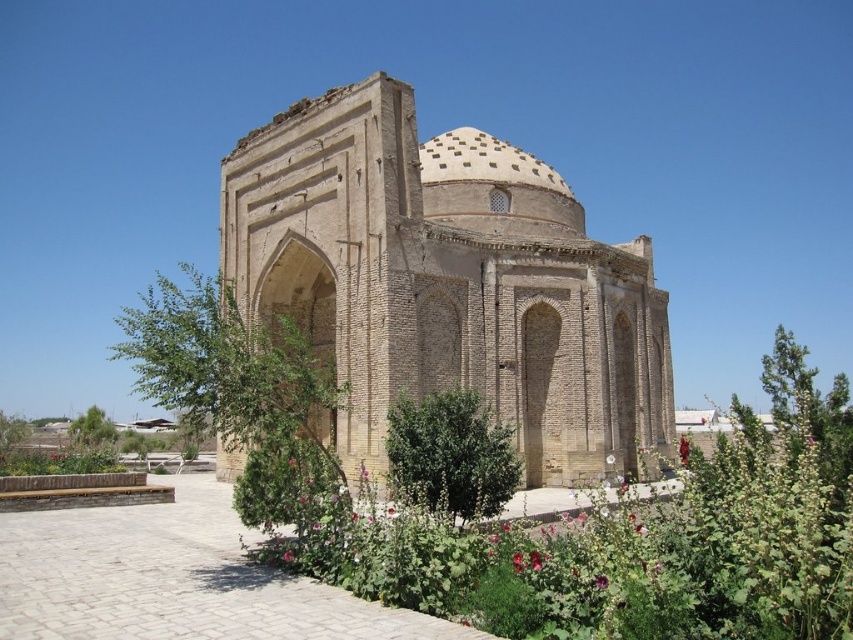
Does brown brick dome at center have a larger size compared to green leafy plants at center?

Incorrect, brown brick dome at center is not larger than green leafy plants at center.

Is brown brick dome at center below green leafy plants at center?

Incorrect, brown brick dome at center is not positioned below green leafy plants at center.

The width and height of the screenshot is (853, 640). What do you see at coordinates (447, 282) in the screenshot? I see `brown brick dome at center` at bounding box center [447, 282].

Locate an element on the screen. brown brick dome at center is located at coordinates (447, 282).